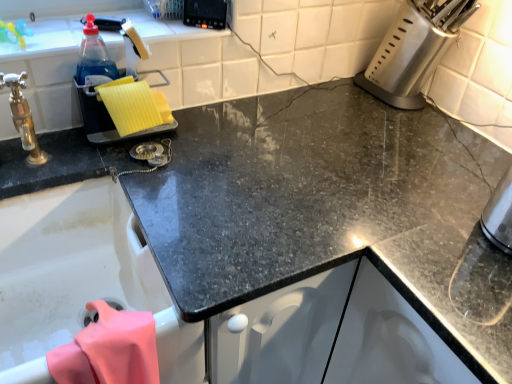
Find the location of a particular element. Image resolution: width=512 pixels, height=384 pixels. free space to the right of yellow sponge at left, which is the 1th appliance in left-to-right order is located at coordinates (211, 140).